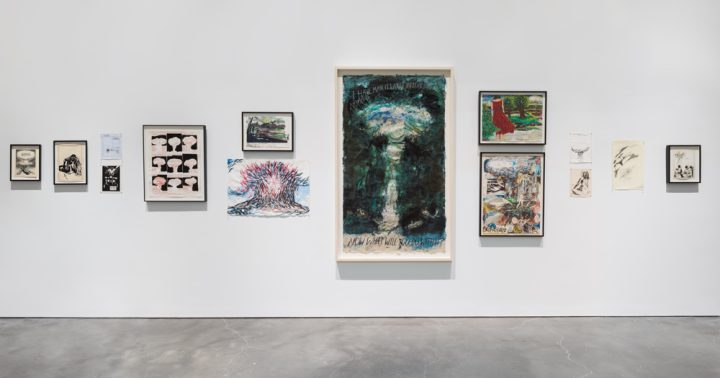
Find the location of a particular element. The image size is (720, 378). art work is located at coordinates (256, 202).